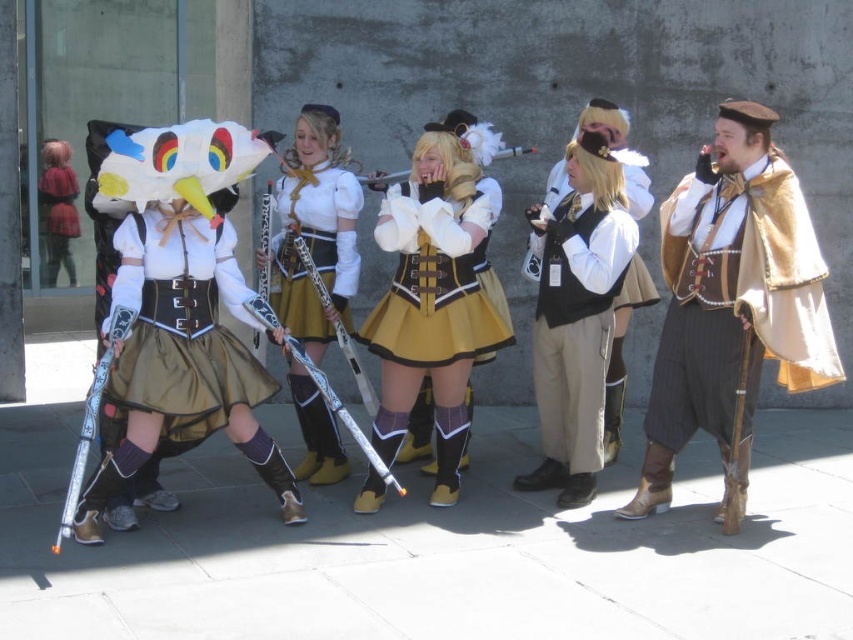
Is gold satin skirt at center bigger than plaid fabric shirt at left?

Indeed, gold satin skirt at center has a larger size compared to plaid fabric shirt at left.

Is the position of gold satin skirt at center less distant than that of plaid fabric shirt at left?

Yes, it is in front of plaid fabric shirt at left.

Who is more distant from viewer, [403,380] or [48,144]?

Point [48,144]

Image resolution: width=853 pixels, height=640 pixels. Find the location of `gold satin skirt at center`. gold satin skirt at center is located at coordinates (432, 300).

Is matte brown cape at right bigger than matte black skirt at left?

Correct, matte brown cape at right is larger in size than matte black skirt at left.

Can you confirm if matte brown cape at right is positioned below matte black skirt at left?

Incorrect, matte brown cape at right is not positioned below matte black skirt at left.

The width and height of the screenshot is (853, 640). Identify the location of matte brown cape at right. (732, 300).

Does point (753, 196) lie behind point (579, 244)?

No, (753, 196) is closer to viewer.

Describe the element at coordinates (732, 300) in the screenshot. I see `matte brown cape at right` at that location.

This screenshot has height=640, width=853. In order to click on matte brown cape at right in this screenshot , I will do `click(732, 300)`.